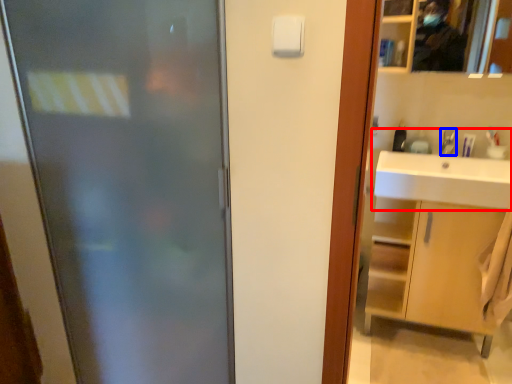
Question: Which object appears closest to the camera in this image, sink (highlighted by a red box) or faucet (highlighted by a blue box)?

Choices:
 (A) sink
 (B) faucet

Answer: (A)